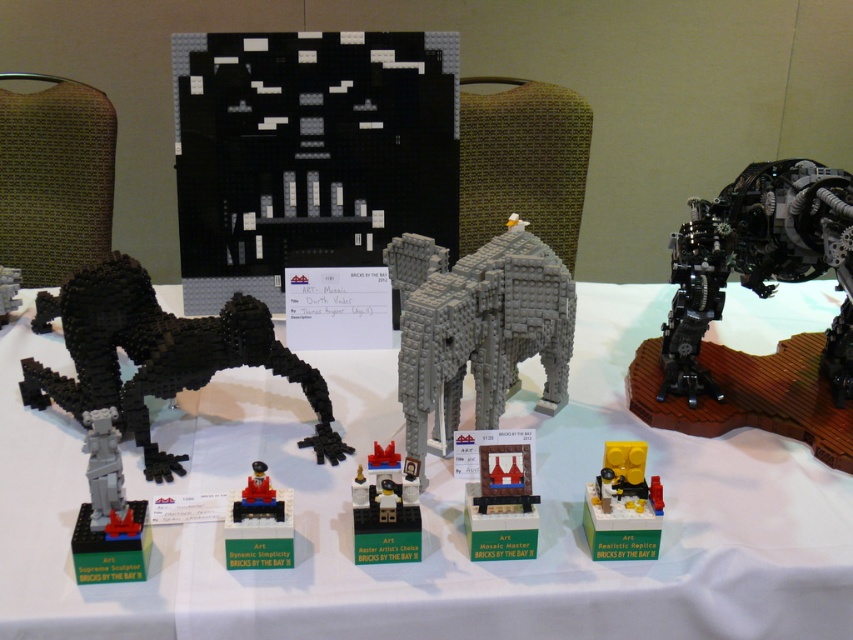
Question: Can you confirm if gray matte elephant at center is positioned below black matte lego animal at left?

Choices:
 (A) yes
 (B) no

Answer: (B)

Question: Is gray matte elephant at center below matte brick mosaic at center?

Choices:
 (A) yes
 (B) no

Answer: (B)

Question: Is matte brick mosaic at center further to the viewer compared to yellow matte brick at center?

Choices:
 (A) no
 (B) yes

Answer: (A)

Question: Which point appears farthest from the camera in this image?

Choices:
 (A) (285, 202)
 (B) (392, 492)

Answer: (A)

Question: Which point is closer to the camera?

Choices:
 (A) (10, 292)
 (B) (229, 561)
 (C) (225, 67)

Answer: (B)

Question: Among these points, which one is farthest from the camera?

Choices:
 (A) (123, 579)
 (B) (268, 547)
 (C) (186, 216)

Answer: (C)